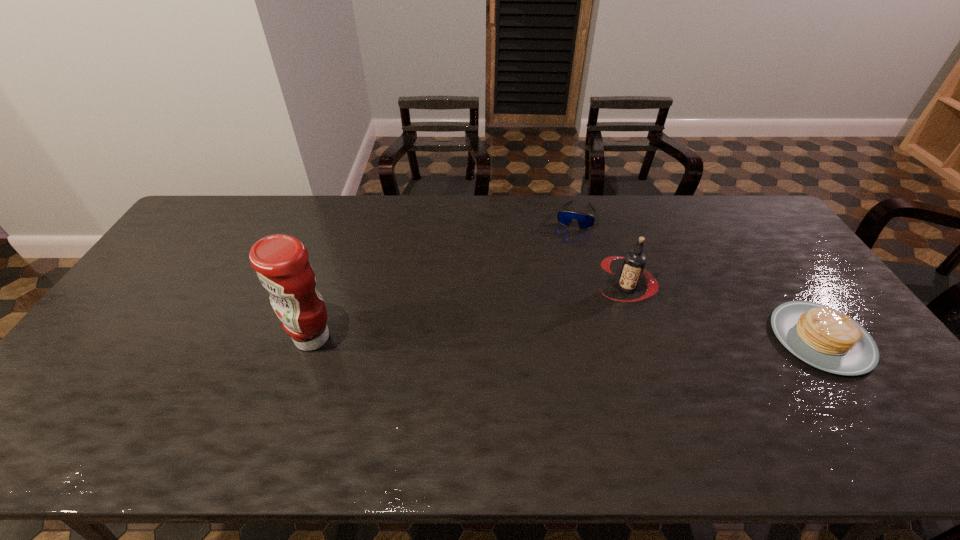
Locate an element on the screen. condiment is located at coordinates (281, 262).

Identify the location of the leftmost object. This screenshot has height=540, width=960. (281, 262).

The width and height of the screenshot is (960, 540). In order to click on pancake in this screenshot , I will do `click(825, 338)`.

Identify the location of root beer. This screenshot has height=540, width=960. (634, 262).

Identify the location of sunglasses. Image resolution: width=960 pixels, height=540 pixels. (585, 220).

The height and width of the screenshot is (540, 960). Identify the location of free location located on the back of the condiment. (342, 252).

Locate an element on the screen. This screenshot has width=960, height=540. vacant space located 0.400m on the left of the pancake is located at coordinates (626, 339).

I want to click on vacant space situated on the label of the root beer, so click(541, 392).

The height and width of the screenshot is (540, 960). I want to click on free point located on the label of the root beer, so click(x=552, y=377).

Where is `free spot located 0.090m on the label of the root beer`? The width and height of the screenshot is (960, 540). free spot located 0.090m on the label of the root beer is located at coordinates (597, 320).